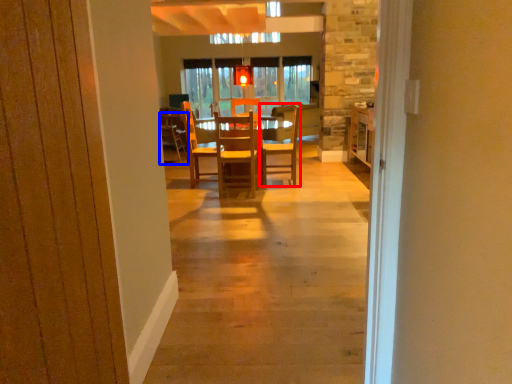
Question: Which of the following is the closest to the observer, chair (highlighted by a red box) or chair (highlighted by a blue box)?

Choices:
 (A) chair
 (B) chair

Answer: (A)